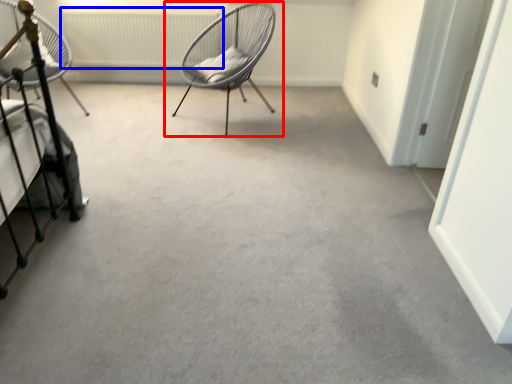
Question: Which of the following is the farthest to the observer, chair (highlighted by a red box) or radiator (highlighted by a blue box)?

Choices:
 (A) chair
 (B) radiator

Answer: (B)